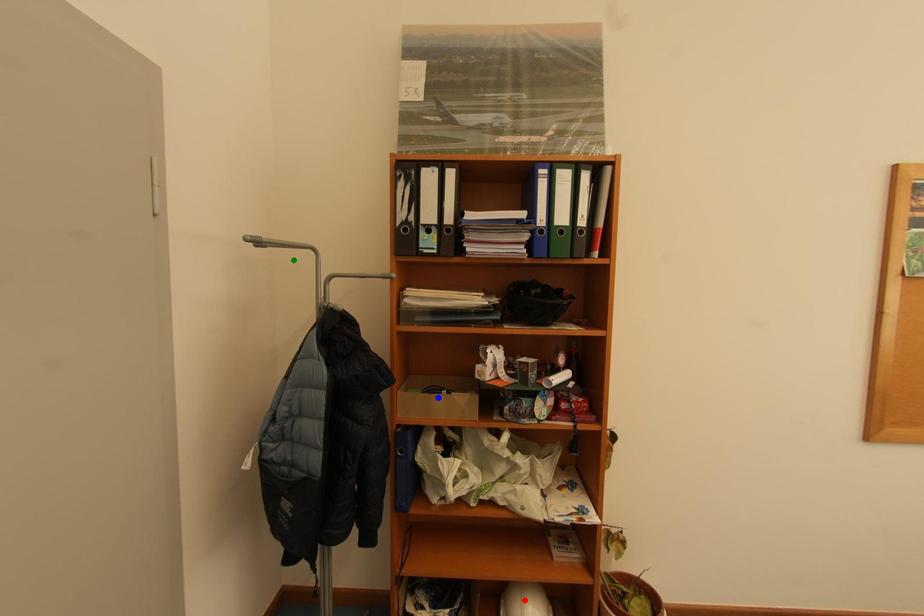
Order these from farthest to nearest:
1. green point
2. blue point
3. red point

red point → blue point → green point